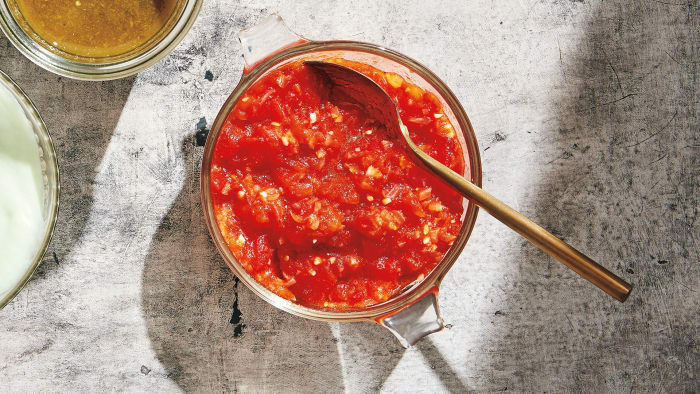
The image size is (700, 394). I want to click on handle, so click(x=407, y=319), click(x=509, y=210).